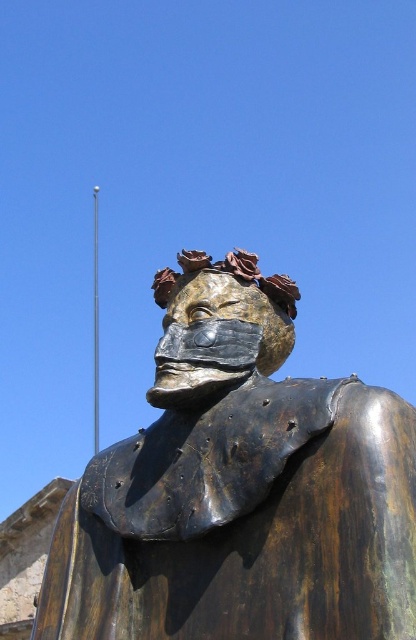
You are an art student who wants to sketch the bronze statue at center and the bronze mask at center. Which object should you focus on first if you want to draw the taller one?

The bronze statue at center is much taller than the bronze mask at center, so you should focus on drawing the bronze statue at center first.

You are standing in a park and see the bronze statue at center. If you want to take a photo of it, where should you position yourself to ensure it fits in the frame?

Since the bronze statue at center is located at point coordinates (240, 488), you should position yourself in the center of the area to capture it within the frame.

You are a maintenance worker tasked with cleaning the bronze statue at center and the bronze mask at center. You have a 1.5 meter long pole. Can you reach both objects with the pole from your current position?

The distance between the bronze statue at center and bronze mask at center is 1.60 meters. Since the pole is only 1.5 meters long, you cannot reach both objects with the same pole from your current position.